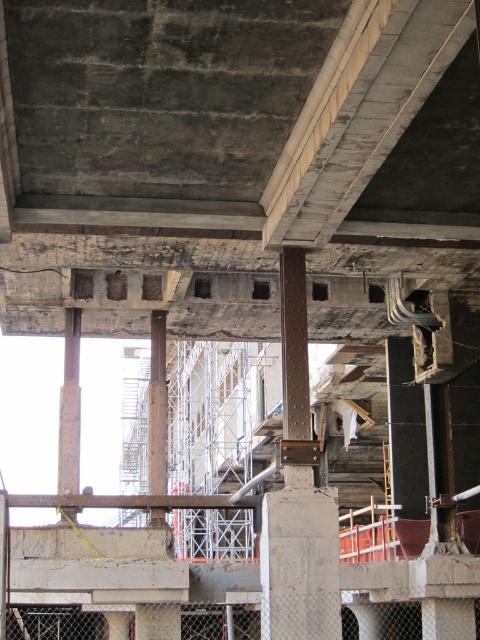
Is concrete/rough at center to the left of rusty metal pillar at center from the viewer's perspective?

No, concrete/rough at center is not to the left of rusty metal pillar at center.

The height and width of the screenshot is (640, 480). What do you see at coordinates (232, 160) in the screenshot?
I see `concrete/rough at center` at bounding box center [232, 160].

This screenshot has width=480, height=640. Find the location of `concrete/rough at center`. concrete/rough at center is located at coordinates (232, 160).